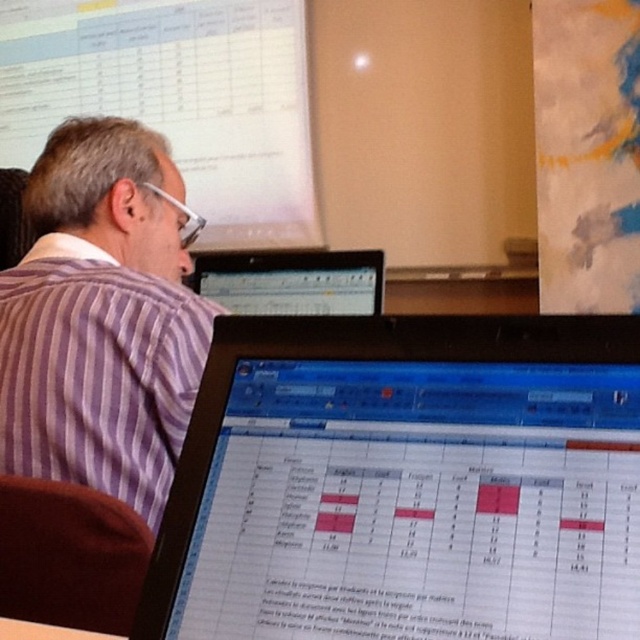
Can you confirm if brown fabric at lower left is shorter than matte black laptop at upper center?

No, brown fabric at lower left is not shorter than matte black laptop at upper center.

Which is more to the right, brown fabric at lower left or matte black laptop at upper center?

matte black laptop at upper center is more to the right.

Where is `brown fabric at lower left`? Image resolution: width=640 pixels, height=640 pixels. brown fabric at lower left is located at coordinates coord(68,556).

Is point (83, 406) behind point (243, 310)?

No.

Where is `purple striped shirt at left`? purple striped shirt at left is located at coordinates tap(102, 317).

Between purple striped shirt at left and brown fabric at lower left, which one appears on the left side from the viewer's perspective?

Positioned to the left is purple striped shirt at left.

Does purple striped shirt at left come in front of brown fabric at lower left?

No, it is not.

Which is in front, point (12, 372) or point (102, 580)?

Point (102, 580) is in front.

You are a GUI agent. You are given a task and a screenshot of the screen. Output one action in this format:
    pyautogui.click(x=<x>, y=<y>)
    Task: Click on the purple striped shirt at left
    This screenshot has width=640, height=640.
    Given the screenshot: What is the action you would take?
    pyautogui.click(x=102, y=317)